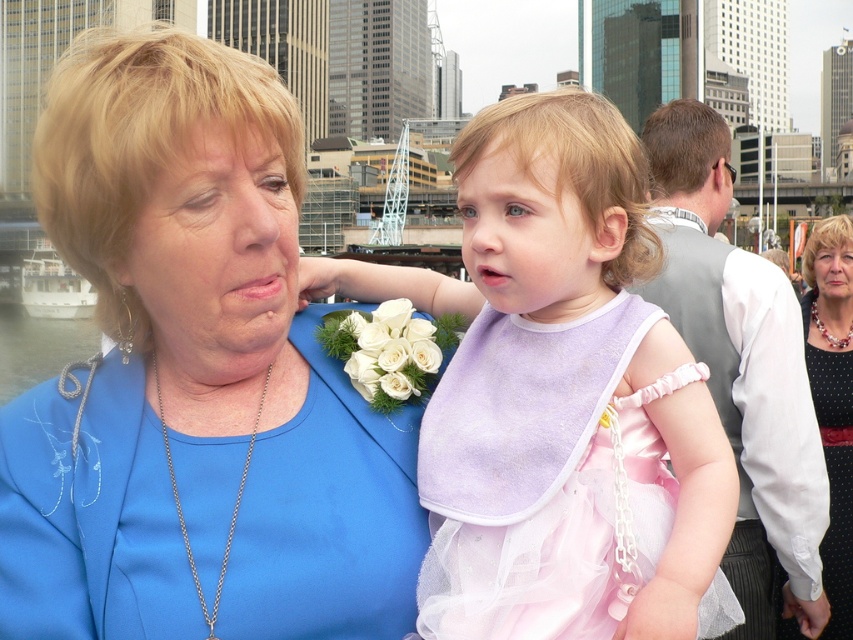
You are standing in the scene and want to move from point A to point B. Point A is at coordinates point (535, 376) and point B is at coordinates point (740, 420). Which point is closer to you?

Point point (535, 376) is closer to you than point point (740, 420).

You are a photographer setting up for an event. You need to place a 1 meter wide backdrop between the pink satin dress at center and the pale pink tulle dress at center. Is there enough space between them to fit the backdrop?

The distance between the pink satin dress at center and the pale pink tulle dress at center is 79.19 centimeters. Since the backdrop is 1 meter wide, which is 100 centimeters, there isn not enough space to fit the backdrop between them.